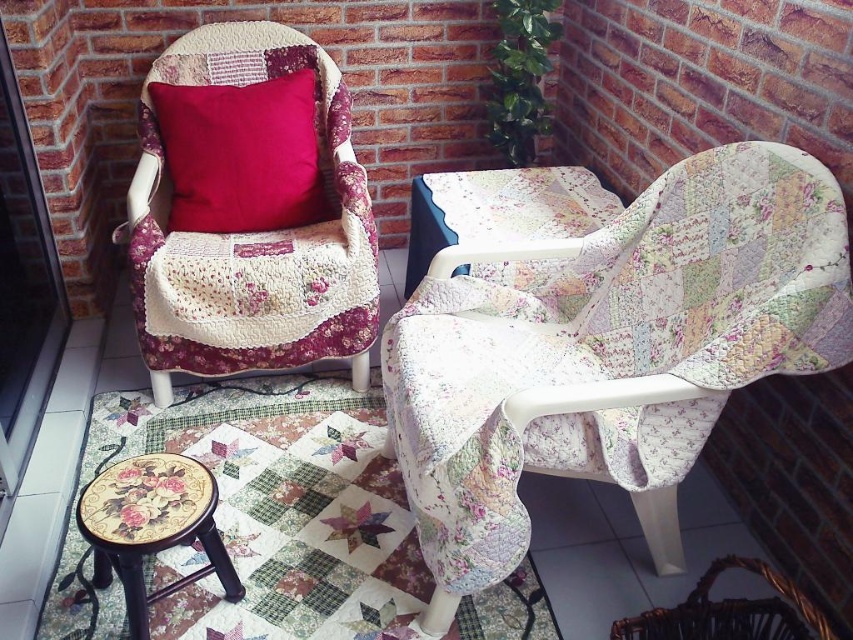
Does floral patchwork armchair at center appear on the right side of floral patchwork armchair at left?

Correct, you'll find floral patchwork armchair at center to the right of floral patchwork armchair at left.

Which of these two, floral patchwork armchair at center or floral patchwork armchair at left, stands shorter?

With less height is floral patchwork armchair at center.

Locate an element on the screen. The width and height of the screenshot is (853, 640). floral patchwork armchair at center is located at coordinates (612, 346).

Is floral patchwork armchair at left bigger than floral fabric stool at lower left?

Correct, floral patchwork armchair at left is larger in size than floral fabric stool at lower left.

Between point (196, 356) and point (167, 592), which one is positioned behind?

Point (196, 356)

The image size is (853, 640). Find the location of `floral patchwork armchair at left`. floral patchwork armchair at left is located at coordinates (251, 234).

Which of these two, floral patchwork armchair at center or floral fabric stool at lower left, stands shorter?

With less height is floral fabric stool at lower left.

Does floral patchwork armchair at center appear under floral fabric stool at lower left?

Incorrect, floral patchwork armchair at center is not positioned below floral fabric stool at lower left.

Identify the location of floral patchwork armchair at center. (612, 346).